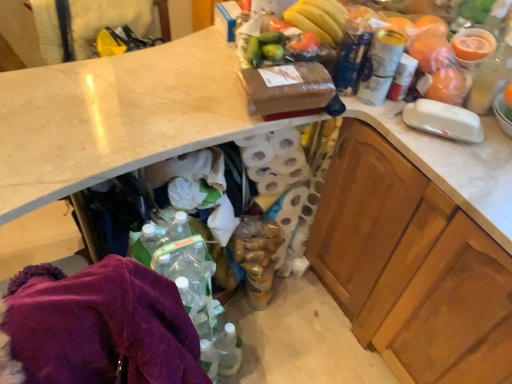
Question: Can you confirm if wooden cabinet at right is bigger than white textured toilet paper at center?

Choices:
 (A) no
 (B) yes

Answer: (B)

Question: Could you tell me if wooden cabinet at right is turned towards white textured toilet paper at center?

Choices:
 (A) yes
 (B) no

Answer: (B)

Question: Considering the relative positions of wooden cabinet at right and white textured toilet paper at center in the image provided, is wooden cabinet at right behind white textured toilet paper at center?

Choices:
 (A) no
 (B) yes

Answer: (A)

Question: Is white textured toilet paper at center inside wooden cabinet at right?

Choices:
 (A) no
 (B) yes

Answer: (A)

Question: Does wooden cabinet at right appear on the left side of white textured toilet paper at center?

Choices:
 (A) no
 (B) yes

Answer: (A)

Question: In the image, is metallic silver can at upper right, which is the first bottle from left to right, positioned in front of or behind translucent plastic cup at upper right, which is counted as the 2th bottle, starting from the left?

Choices:
 (A) behind
 (B) front

Answer: (A)

Question: Choose the correct answer: Is metallic silver can at upper right, arranged as the second bottle when viewed from the right, inside translucent plastic cup at upper right, arranged as the 1th bottle when viewed from the right, or outside it?

Choices:
 (A) inside
 (B) outside

Answer: (B)

Question: Looking at their shapes, would you say metallic silver can at upper right, arranged as the second bottle when viewed from the right, is wider or thinner than translucent plastic cup at upper right, arranged as the 1th bottle when viewed from the right?

Choices:
 (A) wide
 (B) thin

Answer: (B)

Question: Is metallic silver can at upper right, which is the first bottle from left to right, taller or shorter than translucent plastic cup at upper right, arranged as the 1th bottle when viewed from the right?

Choices:
 (A) tall
 (B) short

Answer: (B)

Question: Does point (271, 177) appear closer or farther from the camera than point (378, 187)?

Choices:
 (A) farther
 (B) closer

Answer: (A)

Question: Considering the positions of white textured toilet paper at center and wooden cabinet at right in the image, is white textured toilet paper at center taller or shorter than wooden cabinet at right?

Choices:
 (A) tall
 (B) short

Answer: (B)

Question: In the image, is white textured toilet paper at center positioned in front of or behind wooden cabinet at right?

Choices:
 (A) front
 (B) behind

Answer: (B)

Question: Visually, is white textured toilet paper at center positioned to the left or to the right of wooden cabinet at right?

Choices:
 (A) left
 (B) right

Answer: (A)

Question: Is white textured toilet paper at center in front of or behind metallic silver can at upper right, which is the first bottle from left to right, in the image?

Choices:
 (A) front
 (B) behind

Answer: (B)

Question: In terms of size, does white textured toilet paper at center appear bigger or smaller than metallic silver can at upper right, arranged as the second bottle when viewed from the right?

Choices:
 (A) small
 (B) big

Answer: (B)